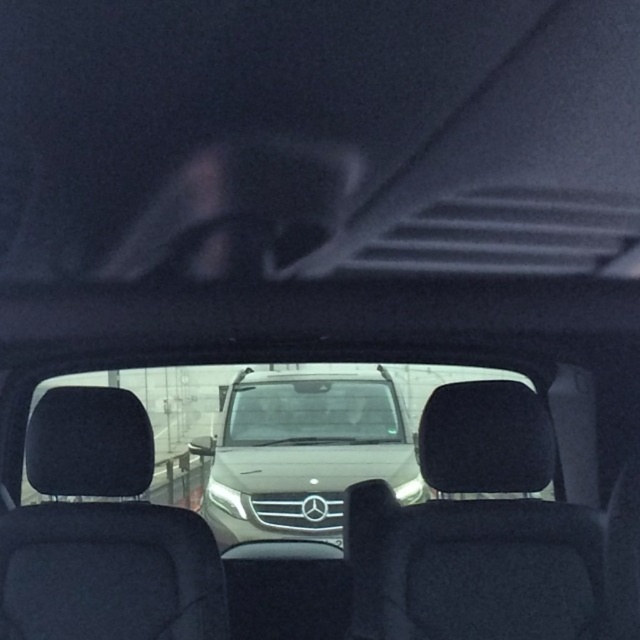
Is black fabric rearview mirror at center to the left of black metallic license plate at center from the viewer's perspective?

Incorrect, black fabric rearview mirror at center is not on the left side of black metallic license plate at center.

Who is positioned more to the left, black fabric rearview mirror at center or black metallic license plate at center?

black metallic license plate at center

Find the location of a particular element. This screenshot has width=640, height=640. black fabric rearview mirror at center is located at coordinates (484, 438).

Identify the location of black fabric rearview mirror at center. (484, 438).

Who is shorter, clear glass windshield at center or black metallic license plate at center?

Standing shorter between the two is black metallic license plate at center.

Can you confirm if clear glass windshield at center is thinner than black metallic license plate at center?

No, clear glass windshield at center is not thinner than black metallic license plate at center.

Between point (310, 380) and point (285, 500), which one is positioned in front?

Point (285, 500)

Identify the location of clear glass windshield at center. The width and height of the screenshot is (640, 640). (312, 412).

Which is more to the right, black fabric rearview mirror at center or suede-like black rearview mirror at left?

Positioned to the right is black fabric rearview mirror at center.

Who is positioned more to the left, black fabric rearview mirror at center or suede-like black rearview mirror at left?

suede-like black rearview mirror at left

Is point (492, 481) in front of point (144, 444)?

Yes.

I want to click on black fabric rearview mirror at center, so click(x=484, y=438).